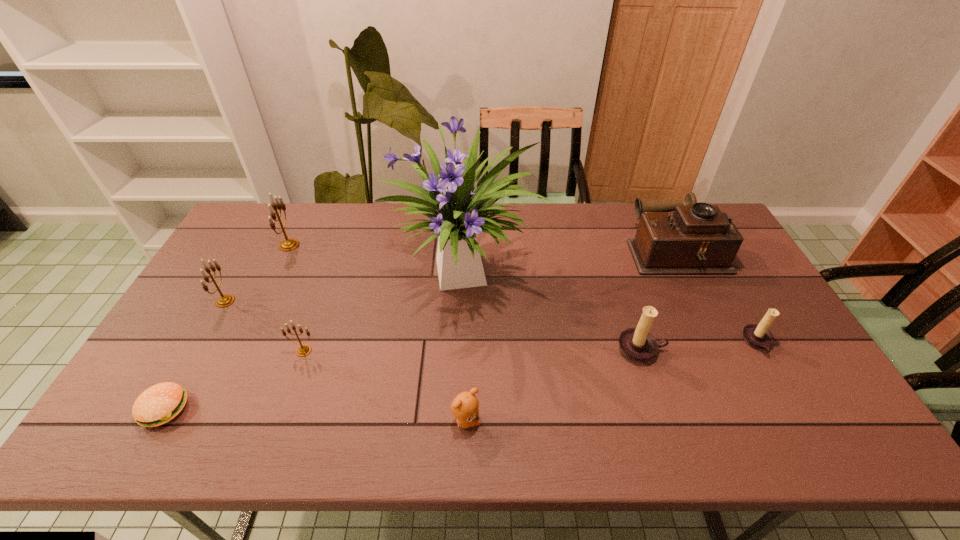
Identify the location of green flower arrangement. (462, 213).

I want to click on flower arrangement, so click(462, 213).

At what (x,y) coordinates should I click in order to perform the action: click on the second gold candelabrum from left to right. Please return your answer as a coordinate pair (x, y). This screenshot has width=960, height=540. Looking at the image, I should click on (289, 244).

The image size is (960, 540). In order to click on the tallest candelabrum in this screenshot , I will do `click(289, 244)`.

Where is `phonograph_record`? Image resolution: width=960 pixels, height=540 pixels. phonograph_record is located at coordinates (697, 238).

Identify the location of the leftmost gold candelabrum. (225, 300).

Locate an element on the screen. The height and width of the screenshot is (540, 960). the leftmost candelabrum is located at coordinates (225, 300).

Find the location of a particular element. This screenshot has height=540, width=960. the left brown candle holder is located at coordinates (637, 344).

Where is `the fourth candelabrum from left to right`? This screenshot has height=540, width=960. the fourth candelabrum from left to right is located at coordinates (637, 344).

Locate an element on the screen. the rightmost candelabrum is located at coordinates (757, 336).